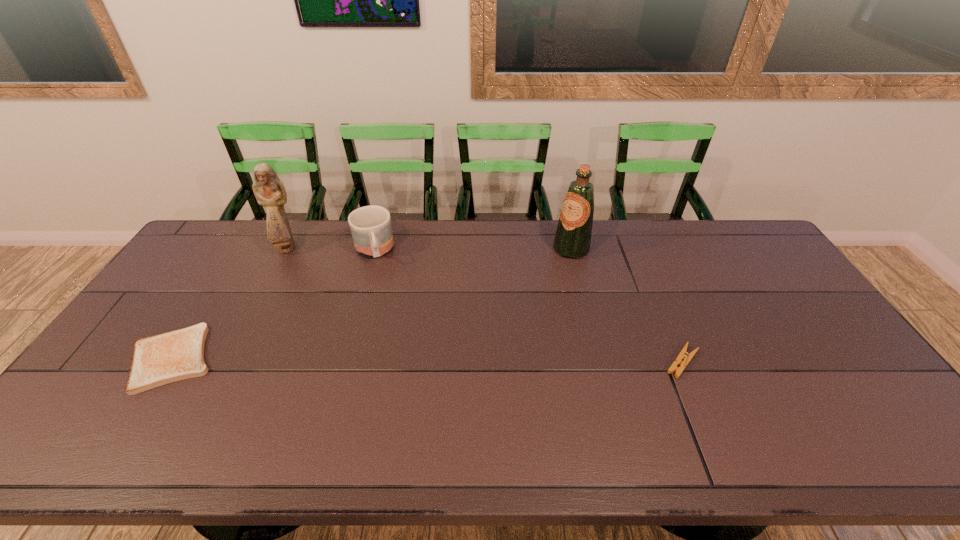
In order to click on the shortest object in this screenshot , I will do `click(177, 355)`.

Locate an element on the screen. The width and height of the screenshot is (960, 540). clothespin is located at coordinates (687, 357).

You are a GUI agent. You are given a task and a screenshot of the screen. Output one action in this format:
    pyautogui.click(x=<x>, y=<y>)
    Task: Click on the olive oil
    The height and width of the screenshot is (540, 960).
    Given the screenshot: What is the action you would take?
    pyautogui.click(x=572, y=239)

Where is `figurine`? The image size is (960, 540). figurine is located at coordinates (268, 189).

This screenshot has width=960, height=540. Identify the location of the third object from right to left. (371, 229).

Locate an element on the screen. the third shortest object is located at coordinates (371, 229).

The height and width of the screenshot is (540, 960). Find the location of `free space located 0.250m on the back of the toast`. free space located 0.250m on the back of the toast is located at coordinates (228, 269).

Find the location of a particular element. This screenshot has width=960, height=540. vacant space located 0.360m on the back of the rightmost object is located at coordinates (640, 261).

This screenshot has width=960, height=540. I want to click on free region located on the front-facing side of the olive oil, so click(x=516, y=307).

This screenshot has height=540, width=960. In order to click on vacant region located on the front-facing side of the olive oil in this screenshot , I will do `click(517, 306)`.